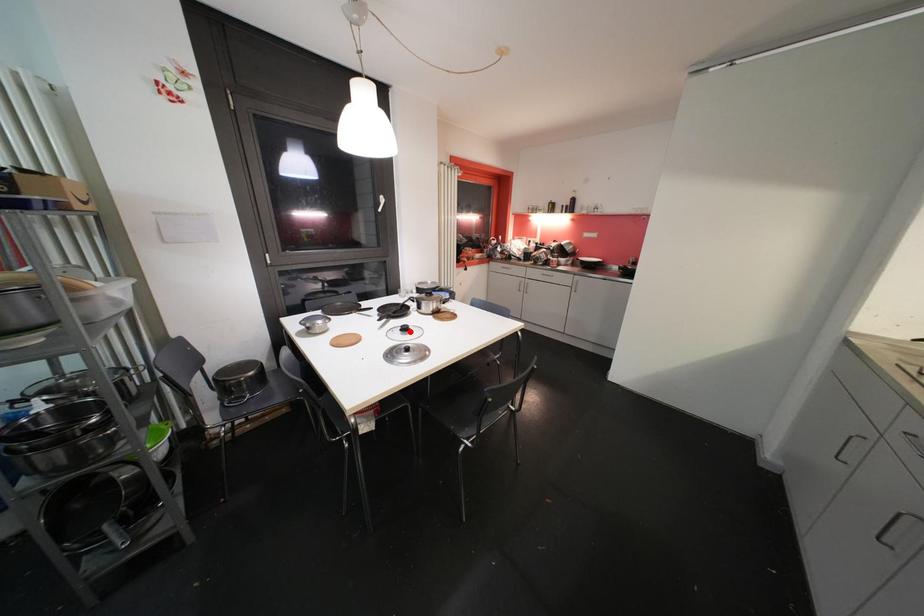
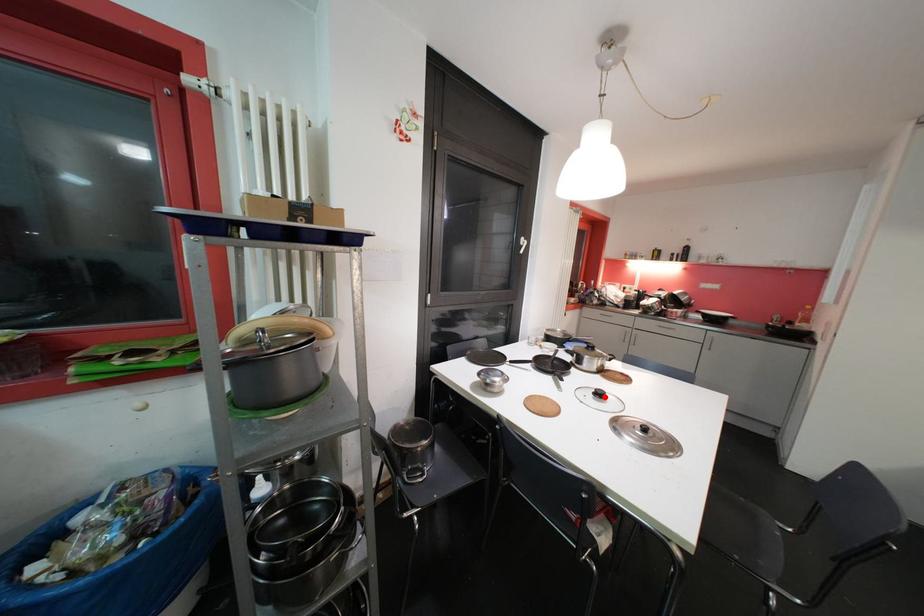
I am providing you with two images of the same scene from different viewpoints. A red point is marked on the first image and another point is marked on the second image. Does the point marked in image1 correspond to the same location as the one in image2?

Yes